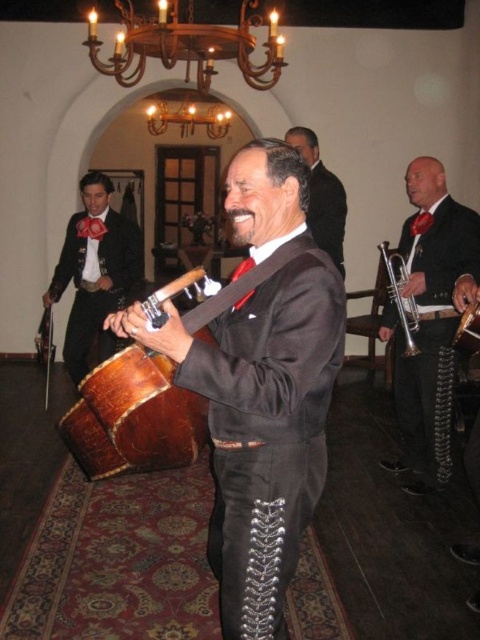
Is point (92, 465) positioned before point (399, 276)?

Yes, it is in front of point (399, 276).

Can you confirm if wooden drum at center is wider than silver metallic trumpet at right?

Yes, wooden drum at center is wider than silver metallic trumpet at right.

Identify the location of wooden drum at center. (137, 417).

Who is more forward, (408, 188) or (79, 337)?

Positioned in front is point (408, 188).

Describe the element at coordinates (429, 321) in the screenshot. I see `matte black trumpet at center` at that location.

I want to click on matte black trumpet at center, so click(x=429, y=321).

This screenshot has height=640, width=480. I want to click on shiny black mariachi outfit at center, so click(x=260, y=428).

The width and height of the screenshot is (480, 640). What do you see at coordinates (260, 428) in the screenshot? I see `shiny black mariachi outfit at center` at bounding box center [260, 428].

Identify the location of shiny black mariachi outfit at center. The height and width of the screenshot is (640, 480). (260, 428).

Where is `shiny black mariachi outfit at center`? shiny black mariachi outfit at center is located at coordinates (260, 428).